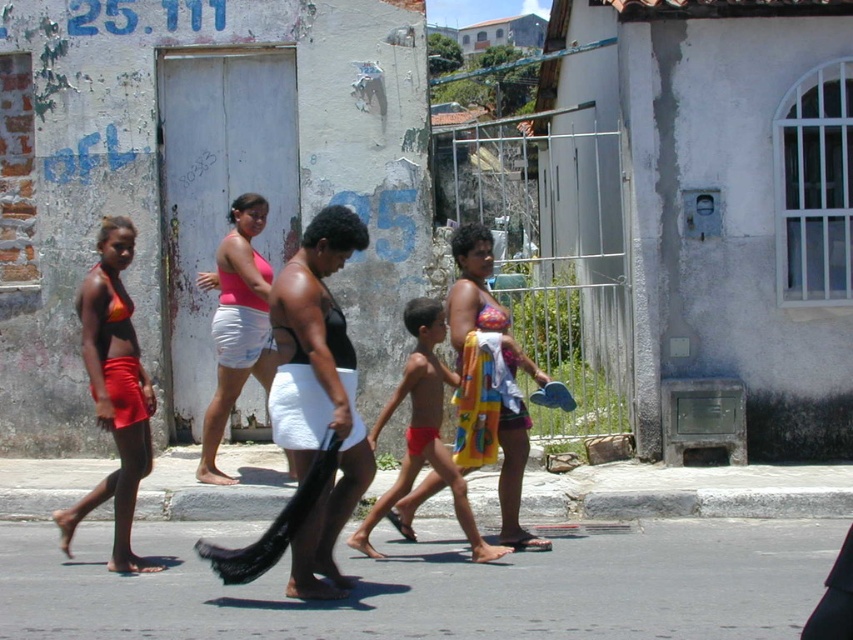
Is point (131, 406) closer to camera compared to point (444, 324)?

Yes, point (131, 406) is closer to viewer.

Does point (125, 570) lie behind point (381, 504)?

No, (125, 570) is closer to viewer.

Locate an element on the screen. This screenshot has width=853, height=640. matte orange bikini top at left is located at coordinates (113, 392).

This screenshot has height=640, width=853. Identify the location of matte orange bikini top at left. (113, 392).

How far apart are black matte bikini top at center and matte orange bikini top at left?

black matte bikini top at center is 3.72 feet from matte orange bikini top at left.

Which of these two, black matte bikini top at center or matte orange bikini top at left, stands shorter?

matte orange bikini top at left

Between point (303, 387) and point (103, 384), which one is positioned in front?

Point (303, 387)

Identify the location of black matte bikini top at center. (318, 394).

Which of these two, pink fabric top at center or red fabric towel at center, stands shorter?

Standing shorter between the two is red fabric towel at center.

Which is behind, point (252, 323) or point (410, 321)?

Point (252, 323)

Image resolution: width=853 pixels, height=640 pixels. Identify the location of pink fabric top at center. (236, 324).

The width and height of the screenshot is (853, 640). Find the location of `pink fabric top at center`. pink fabric top at center is located at coordinates (236, 324).